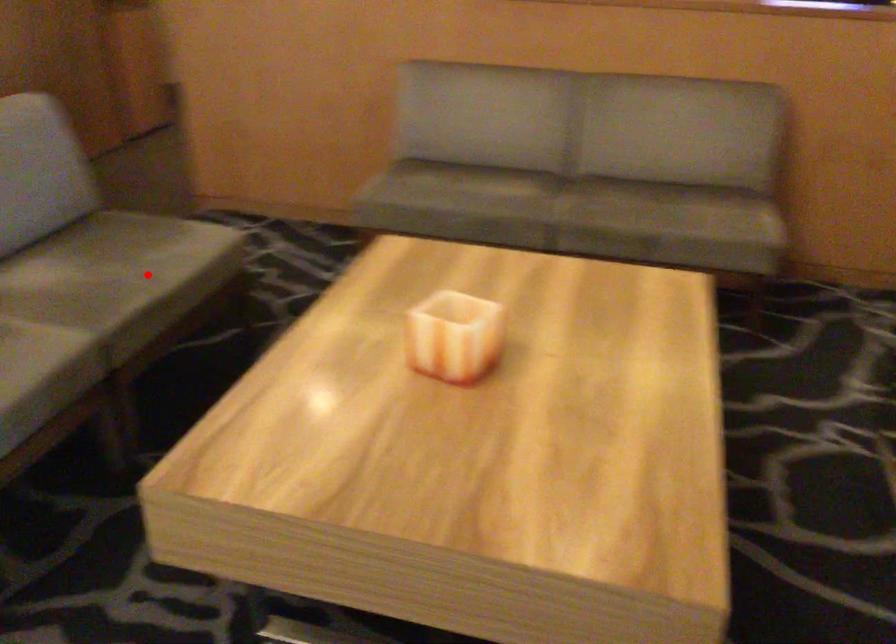
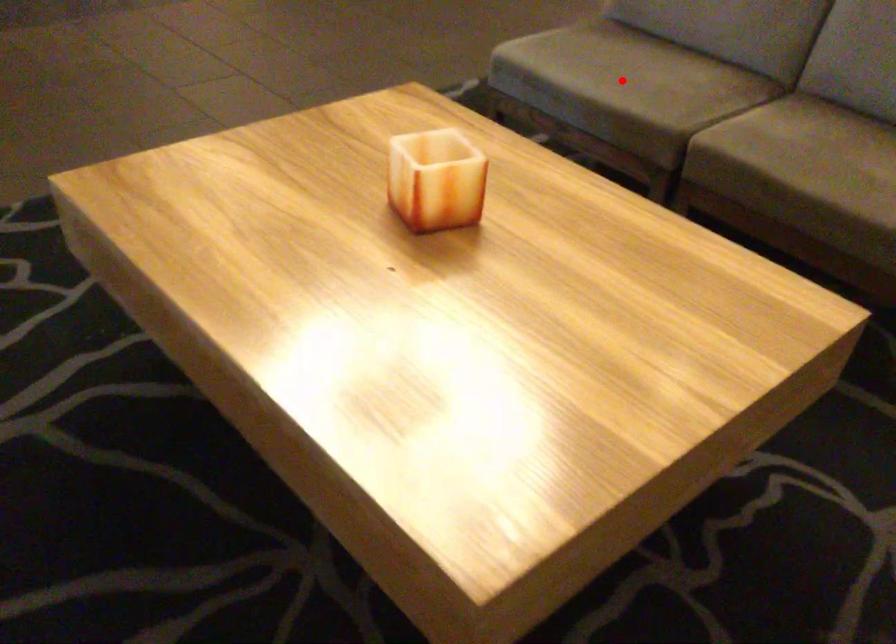
I am providing you with two images of the same scene from different viewpoints. A red point is marked on the first image and another point is marked on the second image. Is the red point in image1 aligned with the point shown in image2?

No